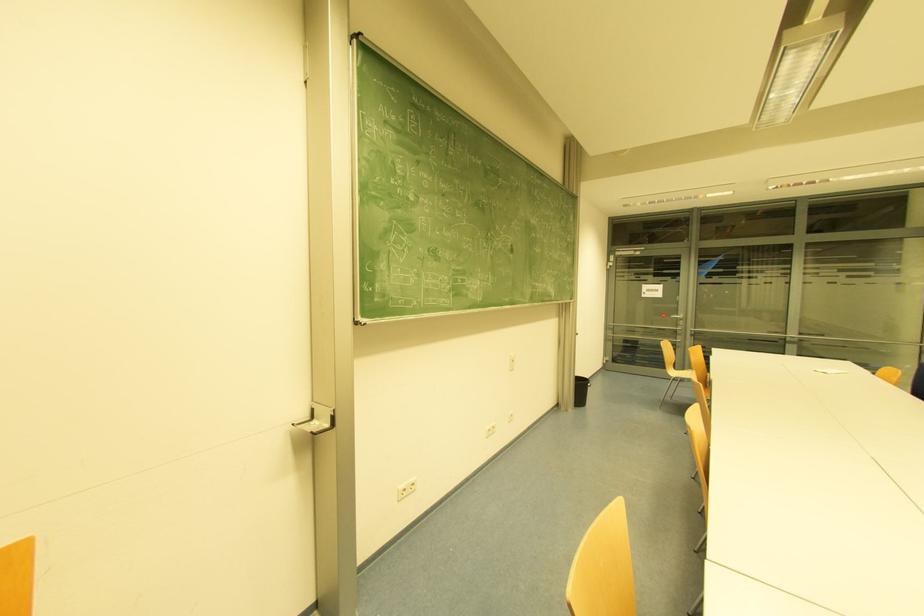
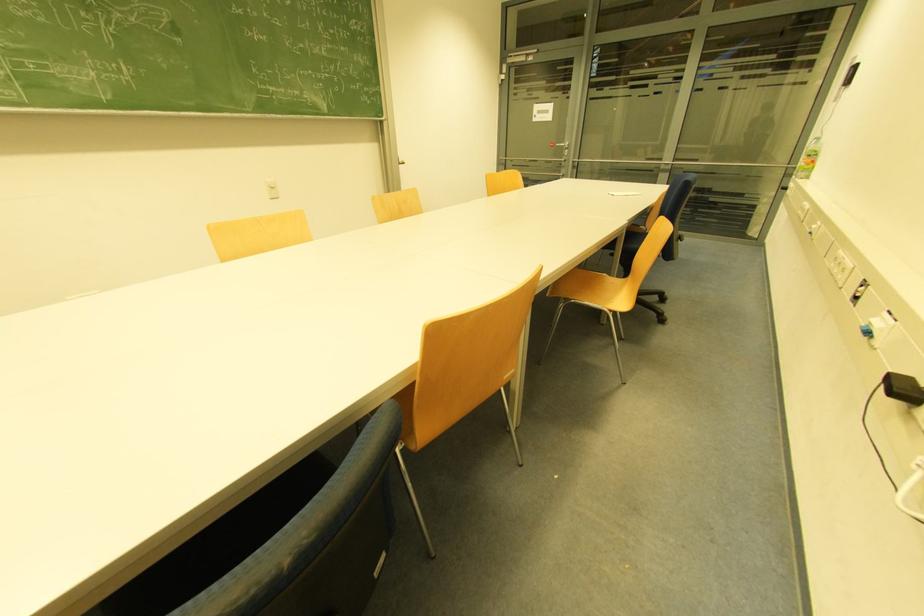
Question: The images are taken continuously from a first-person perspective. In which direction are you moving?

Choices:
 (A) Left
 (B) Right
 (C) Forward
 (D) Backward

Answer: (B)